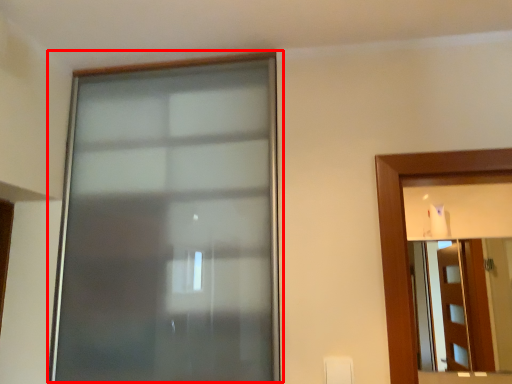
Question: From the image's perspective, what is the correct spatial relationship of window (annotated by the red box) in relation to mirror?

Choices:
 (A) above
 (B) below

Answer: (A)